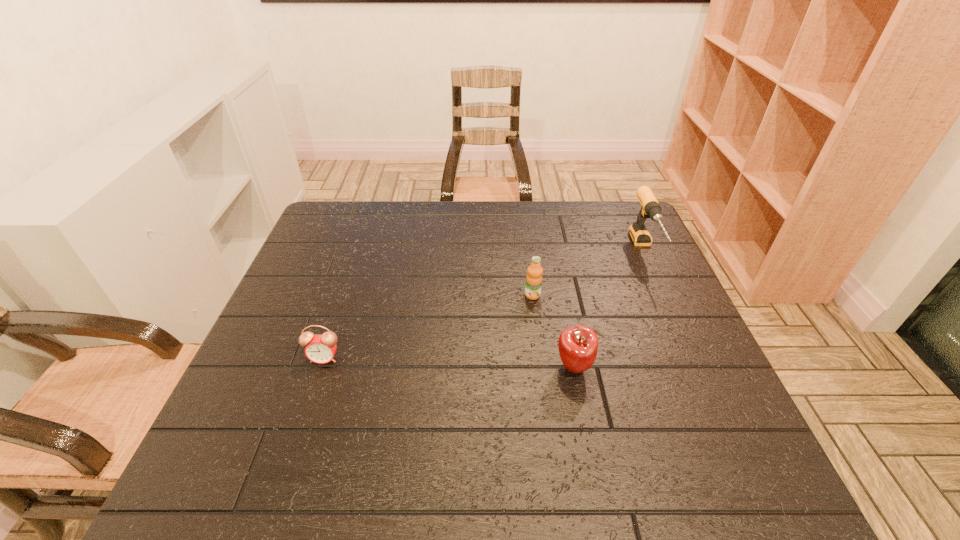
Identify which object is the third closest to the rightmost object. Please provide its 2D coordinates. Your answer should be formatted as a tuple, i.e. [(x, y)], where the tuple contains the x and y coordinates of a point satisfying the conditions above.

[(320, 349)]

I want to click on object that stands as the second closest to the second object from right to left, so click(650, 208).

Locate an element on the screen. This screenshot has width=960, height=540. vacant space that satisfies the following two spatial constraints: 1. on the label of the orange juice; 2. on the left side of the apple is located at coordinates (542, 367).

Identify the location of vacant space that satisfies the following two spatial constraints: 1. on the label of the second object from left to right; 2. on the right side of the second object from right to left. (542, 367).

You are a GUI agent. You are given a task and a screenshot of the screen. Output one action in this format:
    pyautogui.click(x=<x>, y=<y>)
    Task: Click on the vacant area in the image that satisfies the following two spatial constraints: 1. on the label of the orange juice; 2. on the right side of the apple
    
    Given the screenshot: What is the action you would take?
    pyautogui.click(x=542, y=367)

The image size is (960, 540). Identify the location of vacant space that satisfies the following two spatial constraints: 1. on the clock face of the second object from right to left; 2. on the right side of the leftmost object. (322, 367).